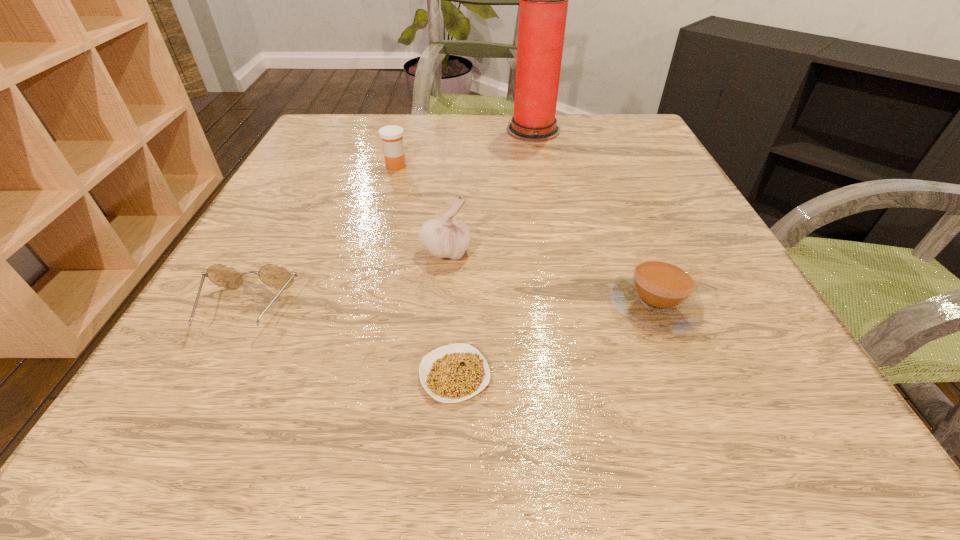
Locate which object ranks fourth in proximity to the fifth shortest object. Please provide its 2D coordinates. Your answer should be formatted as a tuple, i.e. [(x, y)], where the tuple contains the x and y coordinates of a point satisfying the conditions above.

[(392, 141)]

Find the location of `object that is the fifth closest to the leftmost object`. object that is the fifth closest to the leftmost object is located at coordinates (543, 6).

Identify the location of free space that satisfies the following two spatial constraints: 1. at the discharge end of the farthest object; 2. on the front-facing side of the leftmost object. This screenshot has width=960, height=540. (569, 310).

Identify the location of free space in the image that satisfies the following two spatial constraints: 1. on the back side of the fifth shortest object; 2. on the label of the fifth object from right to left. (453, 166).

You are a GUI agent. You are given a task and a screenshot of the screen. Output one action in this format:
    pyautogui.click(x=<x>, y=<y>)
    Task: Click on the vacant space that satisfies the following two spatial constraints: 1. on the label of the medicine; 2. on the back side of the nearest object
    
    Given the screenshot: What is the action you would take?
    pyautogui.click(x=337, y=375)

At what (x,y) coordinates should I click in order to perform the action: click on vacant space that satisfies the following two spatial constraints: 1. on the label of the medicine; 2. on the left side of the cappuccino. Please return your answer as a coordinate pair (x, y). Looking at the image, I should click on (357, 305).

Identify the location of vacant area that satisfies the following two spatial constraints: 1. on the label of the cappuccino; 2. on the right side of the medicine. click(357, 305).

Locate an element on the screen. The image size is (960, 540). vacant space that satisfies the following two spatial constraints: 1. on the back side of the shortest object; 2. on the label of the fifth nearest object is located at coordinates (466, 166).

Locate an element on the screen. vacant space that satisfies the following two spatial constraints: 1. on the back side of the cappuccino; 2. at the discharge end of the fire extinguisher is located at coordinates (585, 130).

The height and width of the screenshot is (540, 960). I want to click on vacant space that satisfies the following two spatial constraints: 1. on the label of the second farthest object; 2. on the front-facing side of the leftmost object, so click(355, 310).